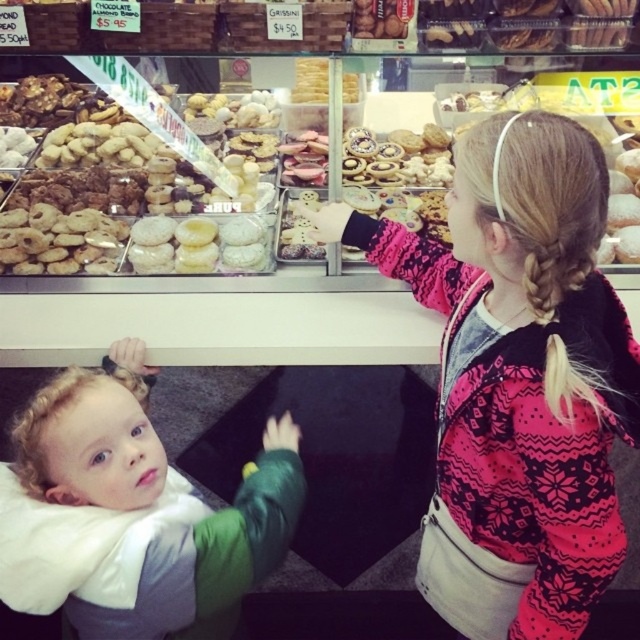
Based on the scene description, where exactly is the pink sweater at upper right located in the display case?

The pink sweater at upper right is located at point (x=516, y=378) in the display case.

You are a customer looking at the display case in the bakery. You notice two items in the display case labeled as the pink sweater at upper right and the curly blonde hair at lower left. Which item takes up more space in the display case?

The pink sweater at upper right takes up more space in the display case because it is larger in size than the curly blonde hair at lower left.

Looking at this image, you are standing in front of the display case in the bakery. The display case has a cookie at point A and a pastry at point B. The coordinates of point A are given as (516, 378). Which item is located at point A?

The pink sweater at upper right is located at point A.